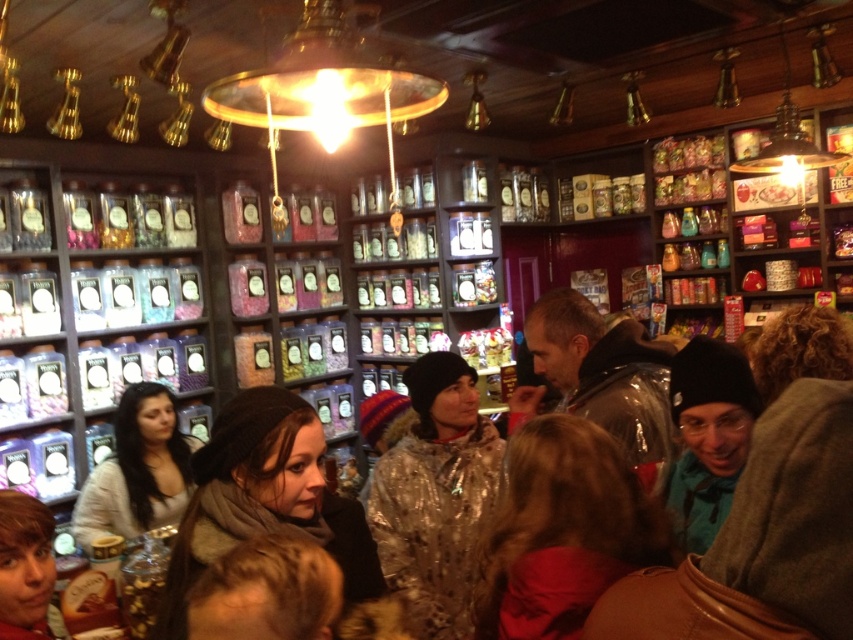
You are a customer in the sweet shop and want to reach both the point at (387, 449) and the point at (689, 374). Which point do you need to walk closer to first to reach them both?

You should first walk closer to point at (689, 374) because it is farther away from you than point at (387, 449), so you need to approach it first to reach both points.

You are a customer in the candy store and want to ask the person with smooth brown hair at lower left about the candies. Which direction should you walk from the glossy black jacket at center to reach them?

The glossy black jacket at center is to the right of smooth brown hair at lower left, so you should walk to the left to reach the person with smooth brown hair at lower left from the glossy black jacket at center.